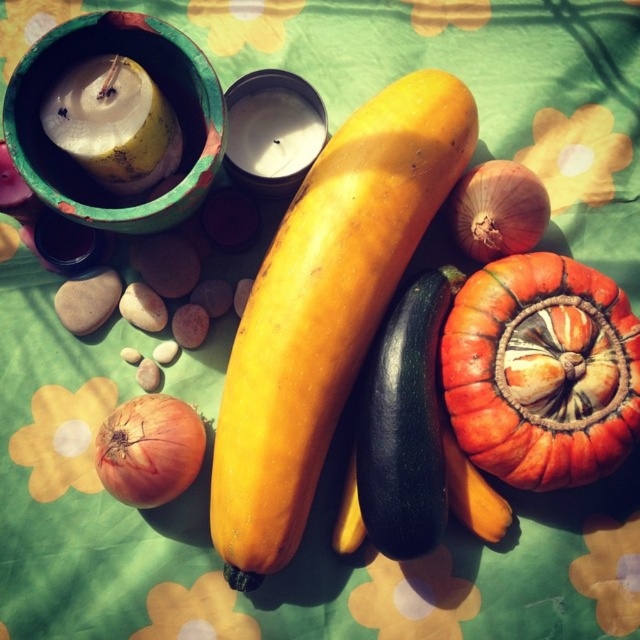
Question: In this image, where is yellow matte squash at center located relative to yellow wax candle at upper left?

Choices:
 (A) above
 (B) below

Answer: (B)

Question: Which of these objects is positioned closest to the orange matte pumpkin at center?

Choices:
 (A) matte orange onion at lower left
 (B) smooth brown onion at center right
 (C) yellow matte squash at center

Answer: (B)

Question: Considering the real-world distances, which object is closest to the matte orange onion at lower left?

Choices:
 (A) smooth brown onion at center right
 (B) orange matte pumpkin at center
 (C) yellow wax candle at upper left
 (D) yellow matte squash at center

Answer: (D)

Question: Is matte orange onion at lower left thinner than smooth brown onion at center right?

Choices:
 (A) yes
 (B) no

Answer: (B)

Question: Is matte orange onion at lower left thinner than smooth brown onion at center right?

Choices:
 (A) no
 (B) yes

Answer: (A)

Question: Among these objects, which one is nearest to the camera?

Choices:
 (A) matte orange onion at lower left
 (B) yellow matte squash at center

Answer: (A)